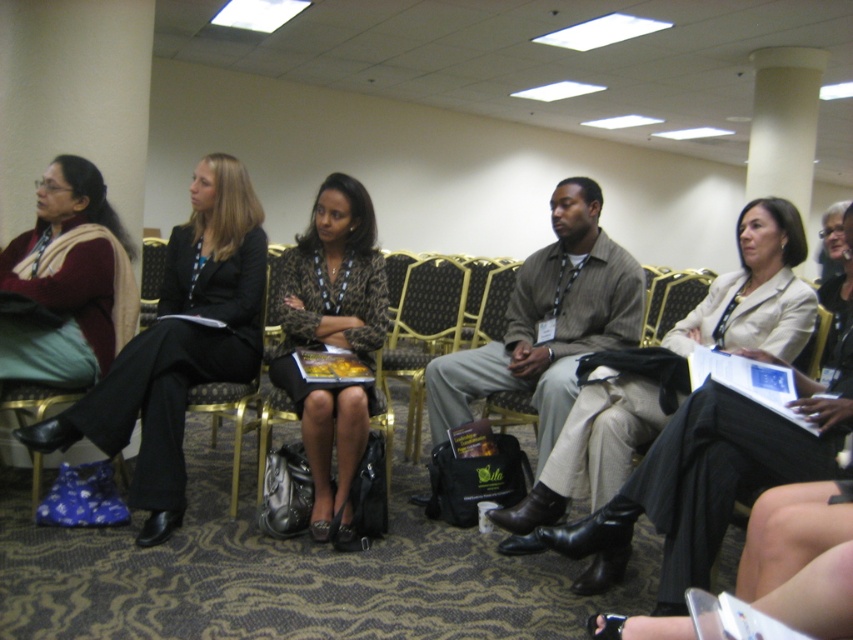
You are a photographer in the conference room and want to take a photo of the matte gray shirt at center and the black fabric chair at center. Which object should you focus on first if you want to capture both clearly in the same frame?

The matte gray shirt at center is located above the black fabric chair at center. Since the shirt is above the chair, you should focus on the matte gray shirt at center first to ensure both are in focus.

You are sitting in the black fabric chair at center and want to hand a document to the person wearing the matte gray shirt at center. In which direction should you pass the document?

You should pass the document to the right, as the matte gray shirt at center is located to the right of the black fabric chair at center.